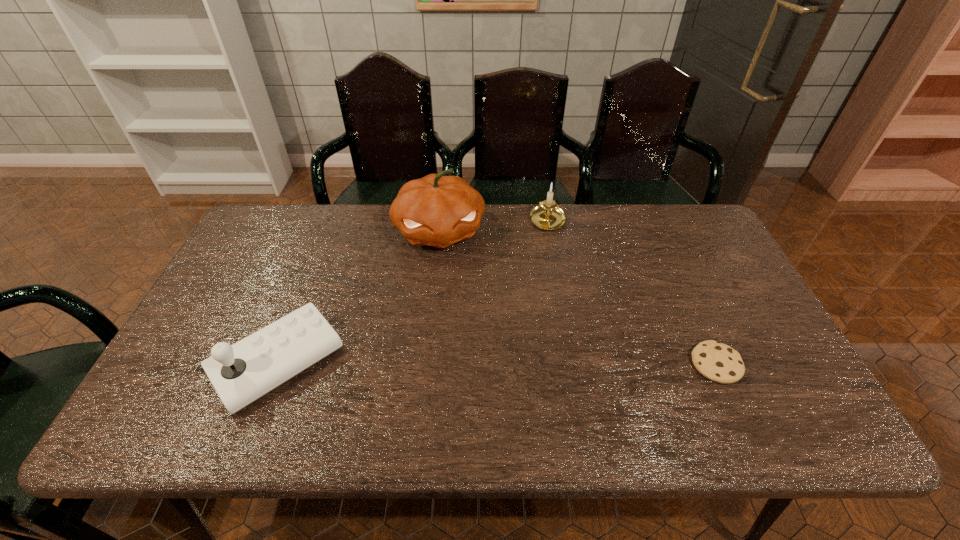
This screenshot has width=960, height=540. I want to click on vacant region that satisfies the following two spatial constraints: 1. on the back side of the joystick; 2. on the right side of the second object from right to left, so [333, 221].

Where is `free spot that satisfies the following two spatial constraints: 1. on the front side of the rightmost object; 2. on the left side of the candle holder`? This screenshot has height=540, width=960. free spot that satisfies the following two spatial constraints: 1. on the front side of the rightmost object; 2. on the left side of the candle holder is located at coordinates [572, 364].

The height and width of the screenshot is (540, 960). Identify the location of vacant point that satisfies the following two spatial constraints: 1. on the back side of the leftmost object; 2. on the right side of the candle holder. (333, 221).

The width and height of the screenshot is (960, 540). What are the coordinates of `free point that satisfies the following two spatial constraints: 1. on the back side of the tallest object; 2. on the left side of the candle holder` in the screenshot? It's located at (441, 221).

Locate an element on the screen. free location that satisfies the following two spatial constraints: 1. on the front side of the pumpkin; 2. on the left side of the shortest object is located at coordinates (426, 364).